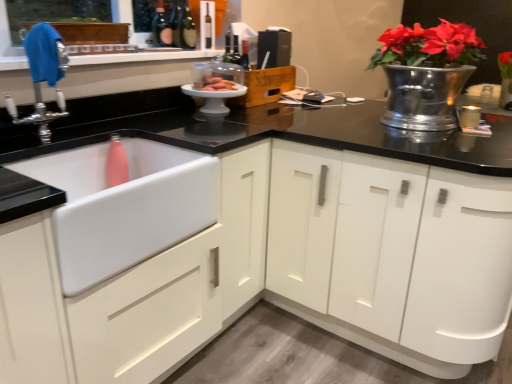
Question: Does white ceramic cake stand at center, which appears as the 1th appliance when viewed from the front, contain white matte sink at lower left?

Choices:
 (A) no
 (B) yes

Answer: (A)

Question: Does white ceramic cake stand at center, which appears as the 1th appliance when viewed from the front, have a greater width compared to white matte sink at lower left?

Choices:
 (A) yes
 (B) no

Answer: (B)

Question: From the image's perspective, is white ceramic cake stand at center, which appears as the 1th appliance when viewed from the front, under white matte sink at lower left?

Choices:
 (A) no
 (B) yes

Answer: (A)

Question: Is white ceramic cake stand at center, the first appliance in the bottom-to-top sequence, smaller than white matte sink at lower left?

Choices:
 (A) no
 (B) yes

Answer: (B)

Question: From a real-world perspective, is white ceramic cake stand at center, which appears as the 1th appliance when viewed from the front, located beneath white matte sink at lower left?

Choices:
 (A) yes
 (B) no

Answer: (B)

Question: From a real-world perspective, is chrome metallic faucet at upper left physically located above or below shiny silver vase at upper right?

Choices:
 (A) below
 (B) above

Answer: (A)

Question: Is point (58, 36) closer or farther from the camera than point (420, 97)?

Choices:
 (A) closer
 (B) farther

Answer: (A)

Question: Is chrome metallic faucet at upper left spatially inside shiny silver vase at upper right, or outside of it?

Choices:
 (A) outside
 (B) inside

Answer: (A)

Question: From the image's perspective, relative to shiny silver vase at upper right, is chrome metallic faucet at upper left above or below?

Choices:
 (A) below
 (B) above

Answer: (A)

Question: Considering their positions, is black matte speaker at upper center, placed as the 1th appliance when sorted from top to bottom, located in front of or behind dark brown glass wine bottle at upper center?

Choices:
 (A) behind
 (B) front

Answer: (A)

Question: In terms of height, does black matte speaker at upper center, placed as the 1th appliance when sorted from top to bottom, look taller or shorter compared to dark brown glass wine bottle at upper center?

Choices:
 (A) short
 (B) tall

Answer: (A)

Question: From the image's perspective, relative to dark brown glass wine bottle at upper center, is black matte speaker at upper center, marked as the 2th appliance in a front-to-back arrangement, above or below?

Choices:
 (A) below
 (B) above

Answer: (A)

Question: Does point (289, 54) appear closer or farther from the camera than point (194, 23)?

Choices:
 (A) farther
 (B) closer

Answer: (A)

Question: Considering the positions of point (159, 213) and point (45, 41), is point (159, 213) closer or farther from the camera than point (45, 41)?

Choices:
 (A) closer
 (B) farther

Answer: (A)

Question: From the image's perspective, is white matte sink at lower left above or below chrome metallic faucet at upper left?

Choices:
 (A) below
 (B) above

Answer: (A)